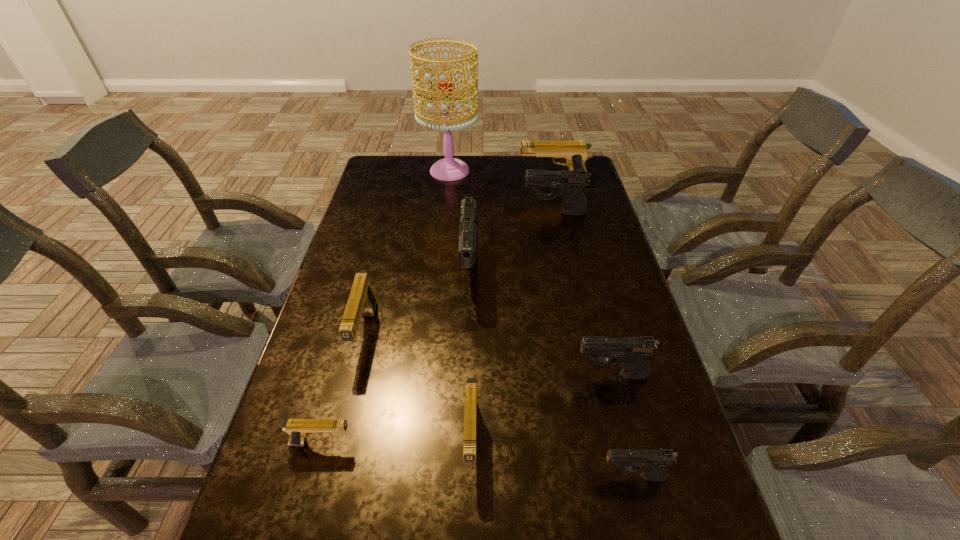
I want to click on vacant area that lies between the farthest tan pistol and the tallest object, so click(x=501, y=177).

Locate an element on the screen. Image resolution: width=960 pixels, height=540 pixels. free space between the second smallest black pistol and the second farthest pistol is located at coordinates (584, 294).

What are the coordinates of `vacant region between the shortest pistol and the third tan pistol from left to right` in the screenshot? It's located at (396, 441).

I want to click on free space between the lampshade and the smallest tan pistol, so click(x=386, y=307).

Point out which object is positioned as the sixth nearest to the second farthest black pistol. Please provide its 2D coordinates. Your answer should be formatted as a tuple, i.e. [(x, y)], where the tuple contains the x and y coordinates of a point satisfying the conditions above.

[(574, 154)]

Select which object appears as the fourth closest to the tallest object. Please provide its 2D coordinates. Your answer should be formatted as a tuple, i.e. [(x, y)], where the tuple contains the x and y coordinates of a point satisfying the conditions above.

[(361, 300)]

The width and height of the screenshot is (960, 540). I want to click on the closest pistol to the shortest object, so click(x=361, y=300).

Identify which pistol is the third closest to the nearest black pistol. Please provide its 2D coordinates. Your answer should be formatted as a tuple, i.e. [(x, y)], where the tuple contains the x and y coordinates of a point satisfying the conditions above.

[(298, 429)]

Identify which black pistol is the third nearest to the third smallest black pistol. Please provide its 2D coordinates. Your answer should be formatted as a tuple, i.e. [(x, y)], where the tuple contains the x and y coordinates of a point satisfying the conditions above.

[(654, 463)]

Identify the location of black pistol object that ranks as the second closest to the third smallest black pistol. click(632, 353).